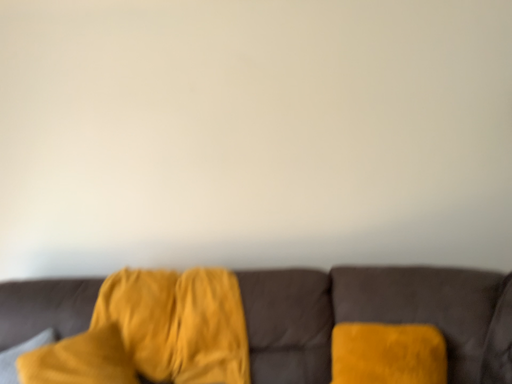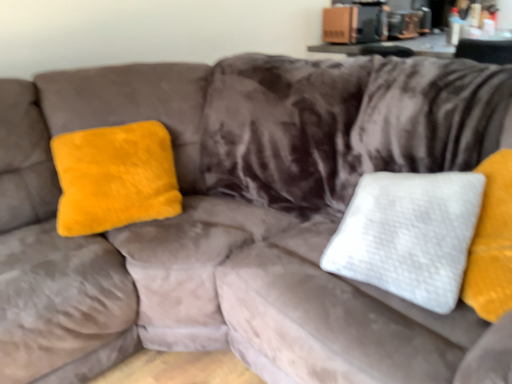
Question: How did the camera likely rotate when shooting the video?

Choices:
 (A) rotated upward
 (B) rotated downward

Answer: (B)